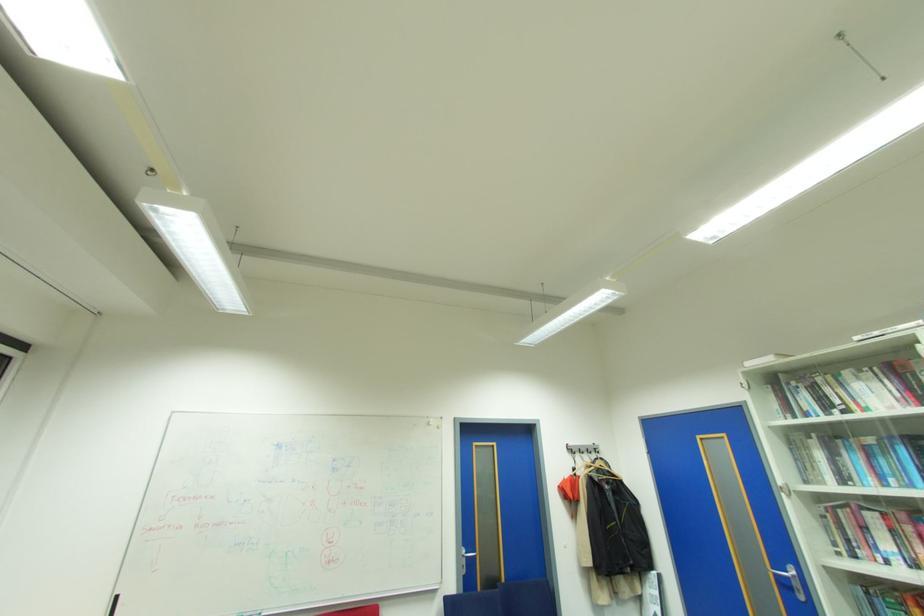
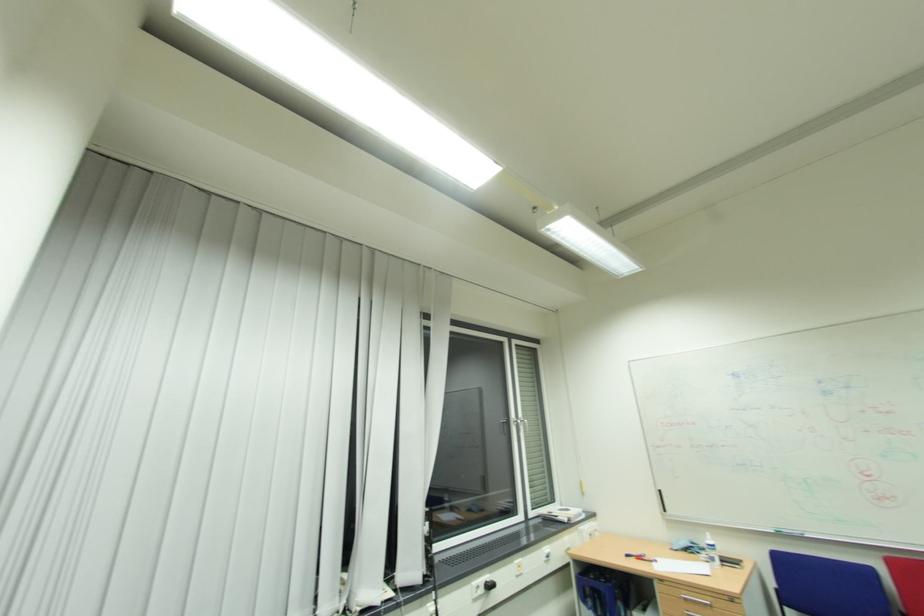
Question: The images are taken continuously from a first-person perspective. In which direction is your viewpoint rotating?

Choices:
 (A) Left
 (B) Right
 (C) Up
 (D) Down

Answer: (A)